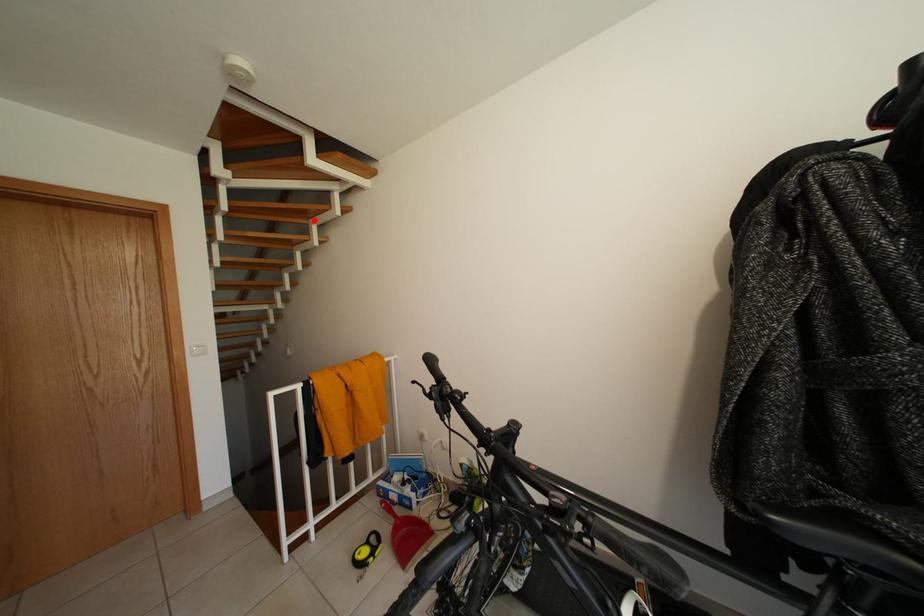
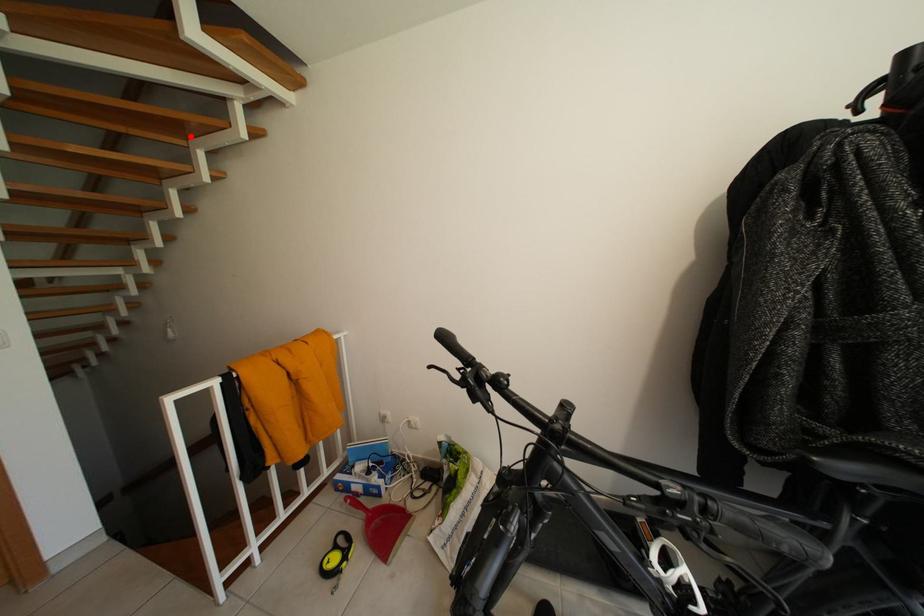
I am providing you with two images of the same scene from different viewpoints. A red point is marked on the first image and another point is marked on the second image. Are the points marked in image1 and image2 representing the same 3D position?

Yes